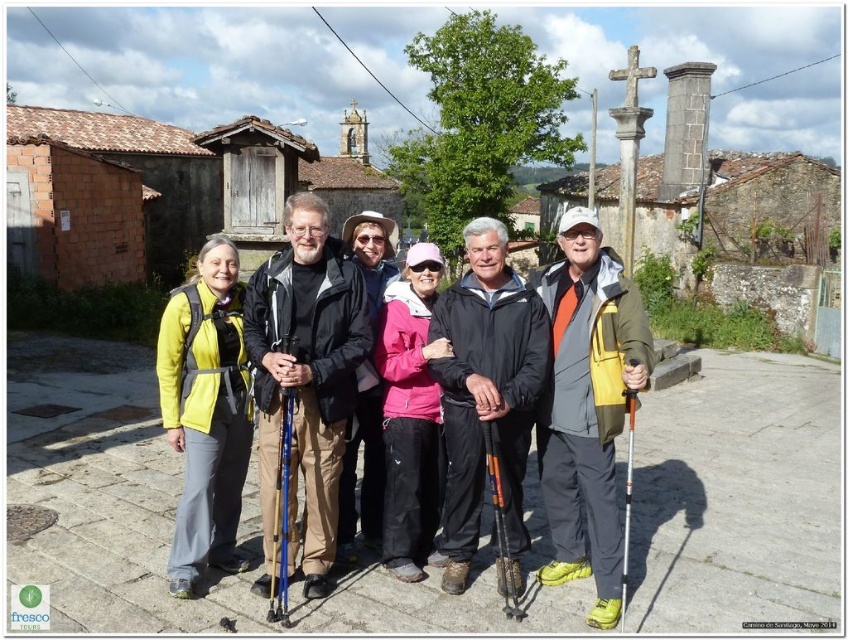
Question: Does orange fabric jacket at center have a smaller size compared to silver metallic ski pole at center?

Choices:
 (A) yes
 (B) no

Answer: (B)

Question: Considering the relative positions of matte yellow jacket at left and silver metallic ski pole at center in the image provided, where is matte yellow jacket at left located with respect to silver metallic ski pole at center?

Choices:
 (A) above
 (B) below

Answer: (A)

Question: Among these points, which one is nearest to the camera?

Choices:
 (A) (626, 484)
 (B) (192, 352)
 (C) (514, 564)
 (D) (395, 513)

Answer: (C)

Question: Which point appears closest to the camera in this image?

Choices:
 (A) (168, 392)
 (B) (495, 461)
 (C) (289, 456)
 (D) (632, 403)

Answer: (D)

Question: Does orange fabric jacket at center appear on the left side of orange textured ski pole at center?

Choices:
 (A) yes
 (B) no

Answer: (B)

Question: Which object is closer to the camera taking this photo?

Choices:
 (A) blue plastic ski pole at center
 (B) orange textured ski pole at center

Answer: (A)